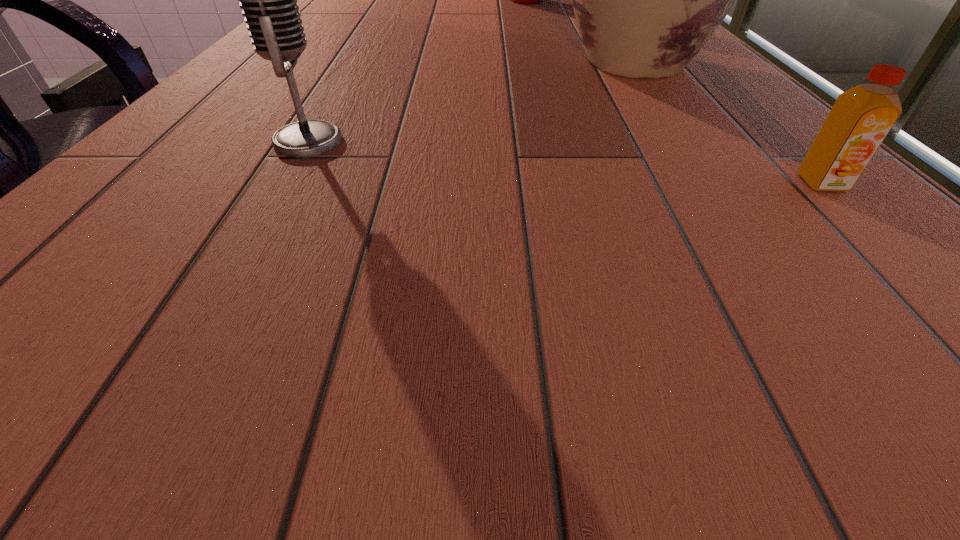
Where is `microphone`? Image resolution: width=960 pixels, height=540 pixels. microphone is located at coordinates (269, 0).

Image resolution: width=960 pixels, height=540 pixels. In order to click on the second shortest object in this screenshot , I will do `click(269, 0)`.

At what (x,y) coordinates should I click in order to perform the action: click on the shortest object. Please return your answer as a coordinate pair (x, y). The width and height of the screenshot is (960, 540). Looking at the image, I should click on (861, 118).

The height and width of the screenshot is (540, 960). Identify the location of the nearest object. (861, 118).

Find the location of a particular element. The width and height of the screenshot is (960, 540). pitcher is located at coordinates (646, 0).

The image size is (960, 540). I want to click on free spot located on the right of the leftmost object, so click(x=478, y=141).

Identify the location of vacant space located 0.110m on the front and back of the orange juice. (897, 256).

Locate an element on the screen. free space located 0.250m on the spout of the second farthest object is located at coordinates (534, 143).

Find the location of a particular element. The image size is (960, 540). free space located on the spout of the second farthest object is located at coordinates (499, 171).

In order to click on vacant space located 0.130m on the spout of the second farthest object in this screenshot , I will do `click(572, 112)`.